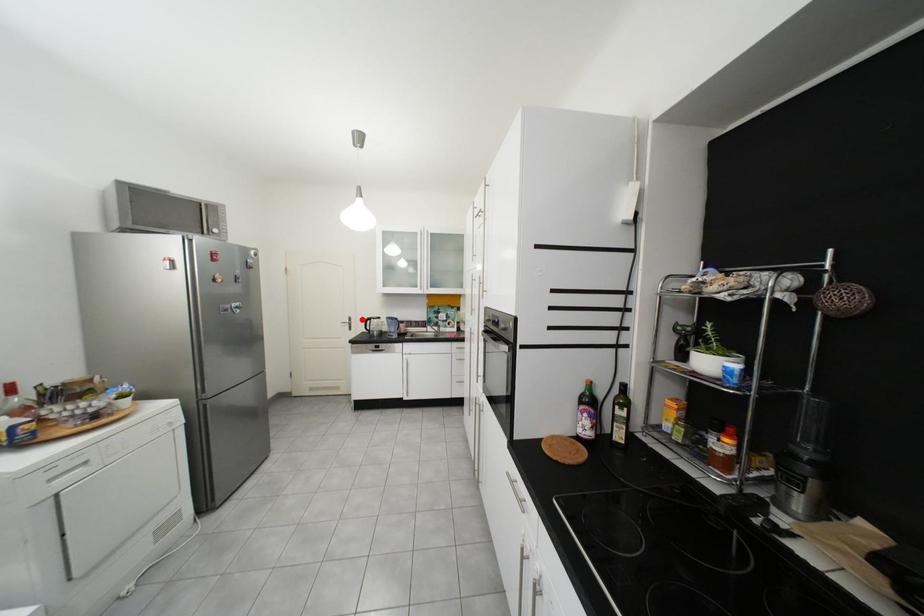
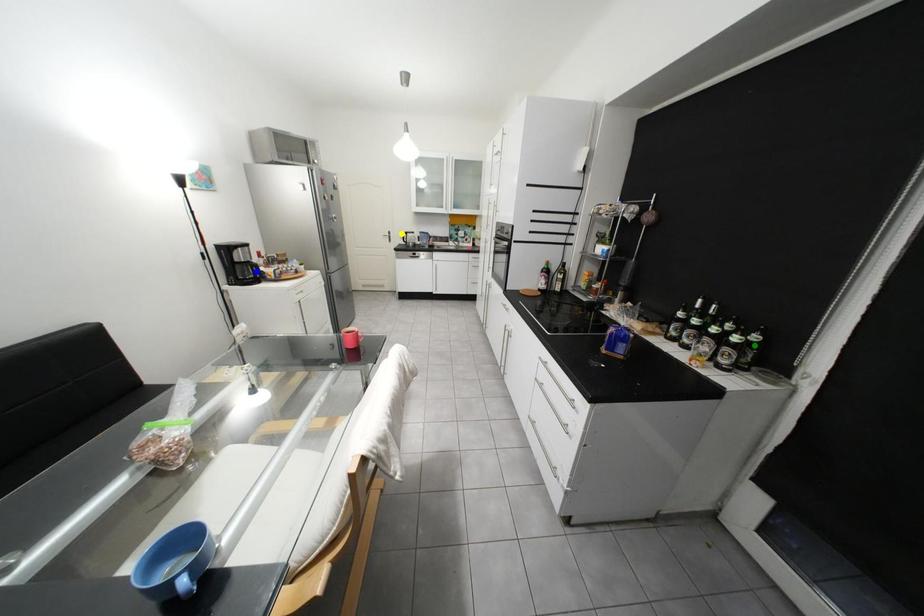
Question: I am providing you with two images of the same scene from different viewpoints. A red point is marked on the first image. You are given multiple points on the second image. Which point in image 2 is actually the same real-world point as the red point in image 1?

Choices:
 (A) yellow point
 (B) blue point
 (C) green point

Answer: (A)